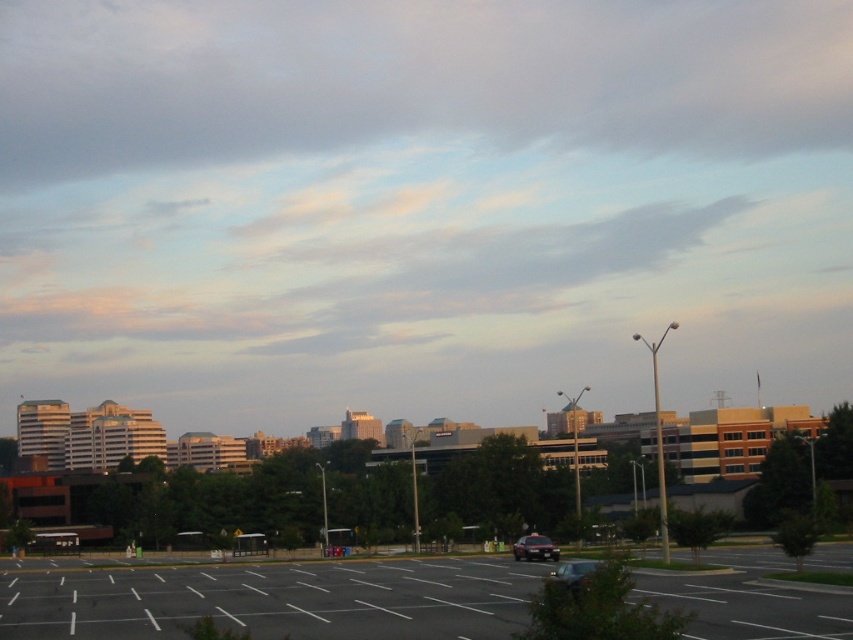
You are standing in the urban landscape and want to determine which of the two points, point (402,58) or point (556,576), is closer to you. Based on the scene description, which point is nearer?

Point (402,58) is further to the viewer than point (556,576). Wait, no, the description says the opposite. Let me check again. The Objects Description states that point (402,58) is further to the viewer than point (556,576). So the answer should be that point (402,58) is further away, so the closer one is point (556,576). Hmm, the question asks which is closer. The answer should be point (556,576) is closer because the first point is further away. Wait, the Objects Description says